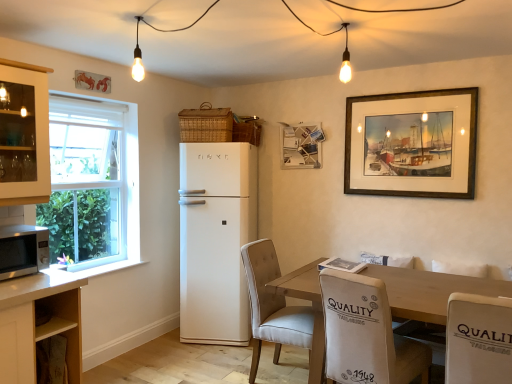
Image resolution: width=512 pixels, height=384 pixels. What do you see at coordinates (24, 134) in the screenshot?
I see `white glass cabinet at left, the first cabinetry from the top` at bounding box center [24, 134].

Describe the element at coordinates (206, 124) in the screenshot. I see `woven brown basket at upper center, positioned as the second basket in right-to-left order` at that location.

This screenshot has width=512, height=384. Describe the element at coordinates (302, 145) in the screenshot. I see `wooden picture frame at upper center, which is the second picture frame from right to left` at that location.

Identify the location of woven brown basket at upper center, placed as the 1th basket when sorted from right to left. (247, 132).

Measure the distance between point (193, 273) and camera.

Point (193, 273) and camera are 11.69 feet apart.

Image resolution: width=512 pixels, height=384 pixels. Find the location of `white glass cabinet at left, arranged as the second cabinetry when ordered from the bottom`. white glass cabinet at left, arranged as the second cabinetry when ordered from the bottom is located at coordinates (24, 134).

Can you confirm if woven brown basket at upper center, which is counted as the second basket, starting from the left, is bigger than white fabric chair at lower right, which is counted as the 3th chair, starting from the left?

No.

Is woven brown basket at upper center, which is counted as the second basket, starting from the left, thinner than white fabric chair at lower right, the 1th chair positioned from the right?

A: Correct, the width of woven brown basket at upper center, which is counted as the second basket, starting from the left, is less than that of white fabric chair at lower right, the 1th chair positioned from the right.

Which is nearer, (237, 133) or (395, 343)?

Positioned in front is point (395, 343).

Looking at their sizes, would you say woven brown basket at upper center, placed as the 1th basket when sorted from right to left, is wider or thinner than beige fabric chair at lower right, the 2th chair when ordered from right to left?

woven brown basket at upper center, placed as the 1th basket when sorted from right to left, is thinner than beige fabric chair at lower right, the 2th chair when ordered from right to left.

How distant is woven brown basket at upper center, placed as the 1th basket when sorted from right to left, from beige fabric chair at lower right, which is the second chair from left to right?

The distance of woven brown basket at upper center, placed as the 1th basket when sorted from right to left, from beige fabric chair at lower right, which is the second chair from left to right, is 2.01 meters.

In the scene shown: Considering the positions of objects woven brown basket at upper center, which is counted as the second basket, starting from the left, and beige fabric chair at lower right, the 2th chair when ordered from right to left, in the image provided, who is more to the left, woven brown basket at upper center, which is counted as the second basket, starting from the left, or beige fabric chair at lower right, the 2th chair when ordered from right to left,?

woven brown basket at upper center, which is counted as the second basket, starting from the left.

Which is further, (429,361) or (19,139)?

The point (19,139) is farther from the camera.

From the image's perspective, is beige fabric chair at lower right, which is the second chair from left to right, above or below white glass cabinet at left, the first cabinetry from the top?

Based on their image positions, beige fabric chair at lower right, which is the second chair from left to right, is located beneath white glass cabinet at left, the first cabinetry from the top.

Could you tell me if beige fabric chair at lower right, which is the second chair from left to right, is facing white glass cabinet at left, the first cabinetry from the top?

No, beige fabric chair at lower right, which is the second chair from left to right, is not aimed at white glass cabinet at left, the first cabinetry from the top.

Between white fabric chair at lower right, the 1th chair positioned from the right, and wooden picture frame at upper center, which appears as the 2th picture frame when viewed from the front, which one appears on the right side from the viewer's perspective?

white fabric chair at lower right, the 1th chair positioned from the right.

In the scene shown: Considering the positions of objects white fabric chair at lower right, the 1th chair positioned from the right, and wooden picture frame at upper center, which appears as the 2th picture frame when viewed from the front, in the image provided, who is behind, white fabric chair at lower right, the 1th chair positioned from the right, or wooden picture frame at upper center, which appears as the 2th picture frame when viewed from the front,?

wooden picture frame at upper center, which appears as the 2th picture frame when viewed from the front.

From a real-world perspective, which is physically above, white fabric chair at lower right, which is counted as the 3th chair, starting from the left, or wooden picture frame at upper center, which appears as the 2th picture frame when viewed from the front?

wooden picture frame at upper center, which appears as the 2th picture frame when viewed from the front, is physically above.

From the image's perspective, starting from the white fabric chair at lower right, the 1th chair positioned from the right, which picture frame is the 2nd one above? Please provide its 2D coordinates.

[(302, 145)]

Would you say white glass cabinet at left, the first cabinetry from the top, is part of white matte refrigerator at center's contents?

No.

Who is taller, white matte refrigerator at center or white glass cabinet at left, arranged as the second cabinetry when ordered from the bottom?

white matte refrigerator at center is taller.

Does white matte refrigerator at center appear on the right side of white glass cabinet at left, arranged as the second cabinetry when ordered from the bottom?

Yes, white matte refrigerator at center is to the right of white glass cabinet at left, arranged as the second cabinetry when ordered from the bottom.

Considering the sizes of objects white matte refrigerator at center and white glass cabinet at left, the first cabinetry from the top, in the image provided, who is thinner, white matte refrigerator at center or white glass cabinet at left, the first cabinetry from the top,?

With smaller width is white glass cabinet at left, the first cabinetry from the top.

From the image's perspective, which is above, white glass cabinet at left, the first cabinetry from the top, or beige fabric chair at lower right, which is the second chair from left to right?

white glass cabinet at left, the first cabinetry from the top.

Is white glass cabinet at left, the first cabinetry from the top, taller than beige fabric chair at lower right, the 2th chair when ordered from right to left?

No, white glass cabinet at left, the first cabinetry from the top, is not taller than beige fabric chair at lower right, the 2th chair when ordered from right to left.

Find the location of a particular element. The height and width of the screenshot is (384, 512). the 2nd chair to the right when counting from the white glass cabinet at left, the first cabinetry from the top is located at coordinates (366, 334).

Is white glass cabinet at left, arranged as the second cabinetry when ordered from the bottom, bigger or smaller than beige fabric chair at lower right, which is the second chair from left to right?

Clearly, white glass cabinet at left, arranged as the second cabinetry when ordered from the bottom, is smaller in size than beige fabric chair at lower right, which is the second chair from left to right.

From a real-world perspective, which object rests below the other?

From a 3D spatial view, wooden framed painting at upper right, which is the first picture frame in front-to-back order, is below.

Would you say wooden framed painting at upper right, which is the first picture frame in front-to-back order, is outside woven brown basket at upper center, positioned as the second basket in right-to-left order?

Yes, wooden framed painting at upper right, which is the first picture frame in front-to-back order, is located beyond the bounds of woven brown basket at upper center, positioned as the second basket in right-to-left order.

Does wooden framed painting at upper right, which is the first picture frame in front-to-back order, come in front of woven brown basket at upper center, positioned as the second basket in right-to-left order?

Yes, wooden framed painting at upper right, which is the first picture frame in front-to-back order, is closer to the viewer.

Is wooden framed painting at upper right, which appears as the first picture frame when viewed from the right, taller or shorter than woven brown basket at upper center, placed as the 1th basket when sorted from left to right?

wooden framed painting at upper right, which appears as the first picture frame when viewed from the right, is taller than woven brown basket at upper center, placed as the 1th basket when sorted from left to right.

Image resolution: width=512 pixels, height=384 pixels. Identify the location of the 1st chair located beneath the woven brown basket at upper center, which is counted as the second basket, starting from the left (from a real-world perspective). (478, 339).

You are a GUI agent. You are given a task and a screenshot of the screen. Output one action in this format:
    pyautogui.click(x=<x>, y=<y>)
    Task: Click on the chair that is the 2nd object to the right of the woven brown basket at upper center, which is counted as the second basket, starting from the left, starting at the anchor
    Image resolution: width=512 pixels, height=384 pixels.
    Given the screenshot: What is the action you would take?
    pyautogui.click(x=366, y=334)

From the image, which object appears to be nearer to white matte refrigerator at center, white glass cabinet at left, arranged as the second cabinetry when ordered from the bottom, or woven brown basket at upper center, positioned as the second basket in right-to-left order?

woven brown basket at upper center, positioned as the second basket in right-to-left order, is positioned closer to the anchor white matte refrigerator at center.

Estimate the real-world distances between objects in this image. Which object is closer to white matte refrigerator at center, satin silver microwave at lower left or beige fabric chair at lower right, which is the second chair from left to right?

The object closer to white matte refrigerator at center is satin silver microwave at lower left.

Based on their spatial positions, is wooden cabinet at lower left, which appears as the second cabinetry when viewed from the top, or wooden framed painting at upper right, which appears as the first picture frame when viewed from the right, closer to beige fabric chair at lower right, which is the second chair from left to right?

The object closer to beige fabric chair at lower right, which is the second chair from left to right, is wooden framed painting at upper right, which appears as the first picture frame when viewed from the right.

When comparing their distances from white fabric chair at lower right, the 1th chair positioned from the right, does wooden picture frame at upper center, arranged as the 1th picture frame when viewed from the back, or white glass cabinet at left, arranged as the second cabinetry when ordered from the bottom, seem closer?

Among the two, wooden picture frame at upper center, arranged as the 1th picture frame when viewed from the back, is located nearer to white fabric chair at lower right, the 1th chair positioned from the right.

Based on the photo, when comparing their distances from white matte refrigerator at center, does wooden table at center or white glass cabinet at left, the first cabinetry from the top, seem further?

wooden table at center.

Estimate the real-world distances between objects in this image. Which object is closer to woven brown basket at upper center, placed as the 1th basket when sorted from left to right, satin silver microwave at lower left or beige fabric chair at lower right, which is the second chair from left to right?

satin silver microwave at lower left is positioned closer to the anchor woven brown basket at upper center, placed as the 1th basket when sorted from left to right.

Which object lies nearer to the anchor point white glass cabinet at left, arranged as the second cabinetry when ordered from the bottom, wooden picture frame at upper center, which is the second picture frame from right to left, or beige fabric chair at center, marked as the third chair in a right-to-left arrangement?

beige fabric chair at center, marked as the third chair in a right-to-left arrangement, is positioned closer to the anchor white glass cabinet at left, arranged as the second cabinetry when ordered from the bottom.

Looking at the image, which one is located closer to wooden table at center, white glass cabinet at left, the first cabinetry from the top, or woven brown basket at upper center, placed as the 1th basket when sorted from right to left?

The object closer to wooden table at center is woven brown basket at upper center, placed as the 1th basket when sorted from right to left.

At what (x,y) coordinates should I click in order to perform the action: click on table between white glass cabinet at left, arranged as the second cabinetry when ordered from the bottom, and wooden framed painting at upper right, which is the second picture frame in left-to-right order, in the horizontal direction. Please return your answer as a coordinate pair (x, y). Looking at the image, I should click on (430, 291).

Where is `picture frame located between white glass cabinet at left, arranged as the second cabinetry when ordered from the bottom, and white fabric chair at lower right, the 1th chair positioned from the right, in the left-right direction`? The image size is (512, 384). picture frame located between white glass cabinet at left, arranged as the second cabinetry when ordered from the bottom, and white fabric chair at lower right, the 1th chair positioned from the right, in the left-right direction is located at coordinates point(302,145).

The width and height of the screenshot is (512, 384). What are the coordinates of `microwave oven between woven brown basket at upper center, positioned as the second basket in right-to-left order, and wooden cabinet at lower left, which appears as the first cabinetry when ordered from the bottom, in the up-down direction` in the screenshot? It's located at point(23,250).

Locate an element on the screen. This screenshot has height=384, width=512. refrigerator located between wooden table at center and woven brown basket at upper center, placed as the 1th basket when sorted from left to right, in the depth direction is located at coordinates (216, 240).